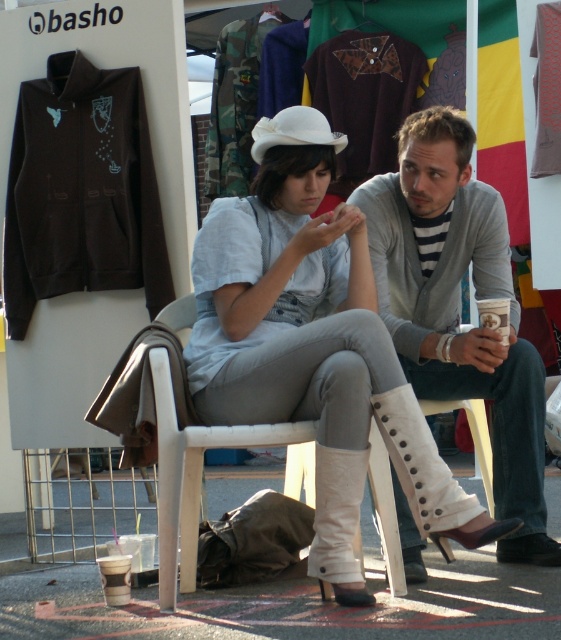
Question: Which object is positioned closest to the gray knit sweater at center?

Choices:
 (A) white felt hat at upper center
 (B) white matte boots at center
 (C) white plastic chair at center

Answer: (B)

Question: Which point is closer to the camera?

Choices:
 (A) white felt hat at upper center
 (B) white plastic chair at center
 (C) white matte boots at center
 (D) gray knit sweater at center

Answer: (B)

Question: Does white plastic chair at center appear over white felt hat at upper center?

Choices:
 (A) no
 (B) yes

Answer: (A)

Question: Is white matte boots at center thinner than white felt hat at upper center?

Choices:
 (A) no
 (B) yes

Answer: (A)

Question: Can you confirm if white plastic chair at center is wider than white felt hat at upper center?

Choices:
 (A) yes
 (B) no

Answer: (A)

Question: Based on their relative distances, which object is nearer to the white felt hat at upper center?

Choices:
 (A) white plastic chair at center
 (B) gray knit sweater at center
 (C) white matte boots at center

Answer: (C)